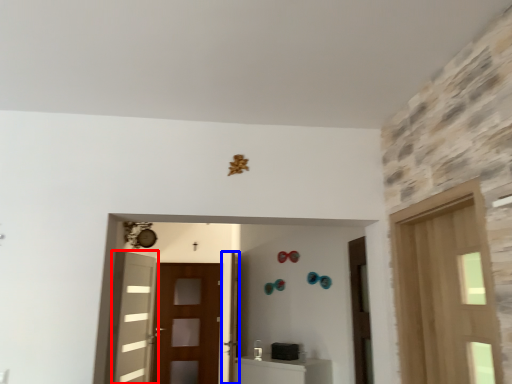
Question: Which object is further to the camera taking this photo, door (highlighted by a red box) or door (highlighted by a blue box)?

Choices:
 (A) door
 (B) door

Answer: (A)